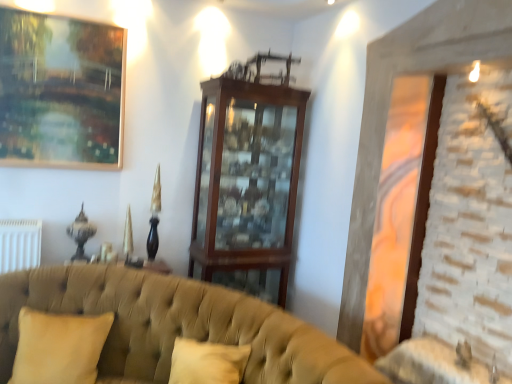
Question: Does tufted fabric couch at lower left have a larger size compared to beige fabric pillow at lower left?

Choices:
 (A) no
 (B) yes

Answer: (B)

Question: Does tufted fabric couch at lower left turn towards beige fabric pillow at lower left?

Choices:
 (A) no
 (B) yes

Answer: (A)

Question: Is tufted fabric couch at lower left not within beige fabric pillow at lower left?

Choices:
 (A) no
 (B) yes

Answer: (B)

Question: Is tufted fabric couch at lower left positioned with its back to beige fabric pillow at lower left?

Choices:
 (A) no
 (B) yes

Answer: (B)

Question: Does tufted fabric couch at lower left appear on the right side of beige fabric pillow at lower left?

Choices:
 (A) yes
 (B) no

Answer: (A)

Question: Does tufted fabric couch at lower left have a lesser height compared to beige fabric pillow at lower left?

Choices:
 (A) no
 (B) yes

Answer: (A)

Question: From the image's perspective, is gold-framed painting at upper left located beneath wooden cabinet at center?

Choices:
 (A) no
 (B) yes

Answer: (A)

Question: Can you confirm if gold-framed painting at upper left is positioned to the left of wooden cabinet at center?

Choices:
 (A) no
 (B) yes

Answer: (B)

Question: Considering the relative sizes of gold-framed painting at upper left and wooden cabinet at center in the image provided, is gold-framed painting at upper left taller than wooden cabinet at center?

Choices:
 (A) no
 (B) yes

Answer: (A)

Question: Is gold-framed painting at upper left smaller than wooden cabinet at center?

Choices:
 (A) no
 (B) yes

Answer: (B)

Question: Is gold-framed painting at upper left wider than wooden cabinet at center?

Choices:
 (A) no
 (B) yes

Answer: (A)

Question: Is gold-framed painting at upper left looking in the opposite direction of wooden cabinet at center?

Choices:
 (A) no
 (B) yes

Answer: (A)

Question: Considering the relative sizes of gold-framed painting at upper left and beige fabric pillow at lower left in the image provided, is gold-framed painting at upper left bigger than beige fabric pillow at lower left?

Choices:
 (A) yes
 (B) no

Answer: (B)